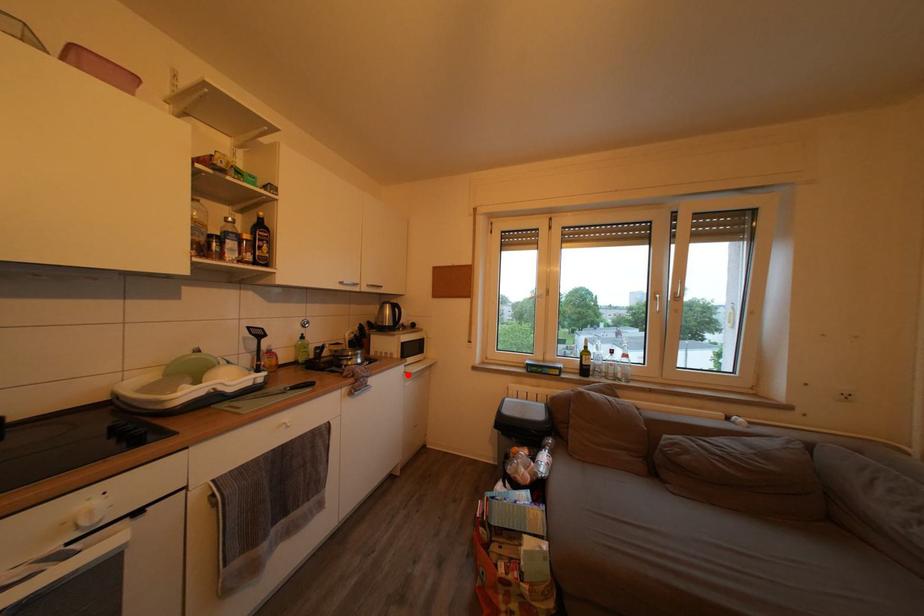
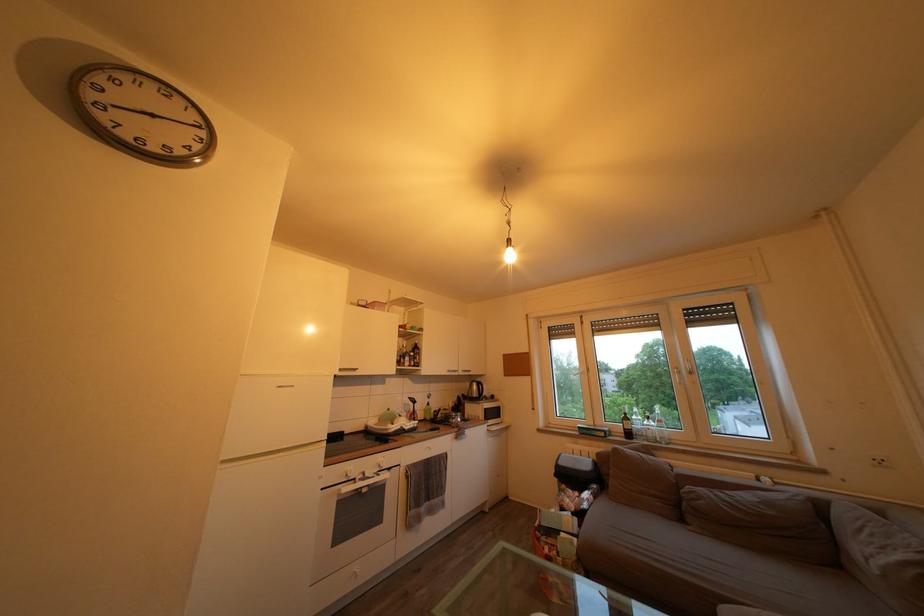
In the second image, find the point that corresponds to the highlighted location in the first image.

(492, 434)